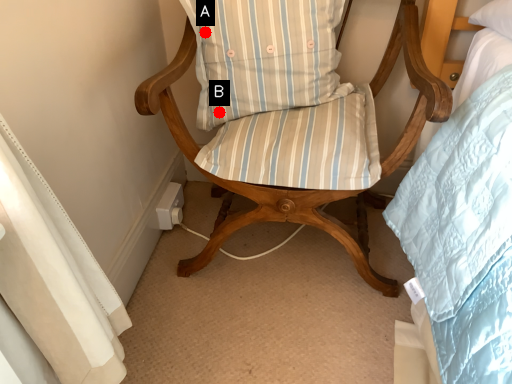
Question: Two points are circled on the image, labeled by A and B beside each circle. Among these points, which one is farthest from the camera?

Choices:
 (A) A is further
 (B) B is further

Answer: (B)